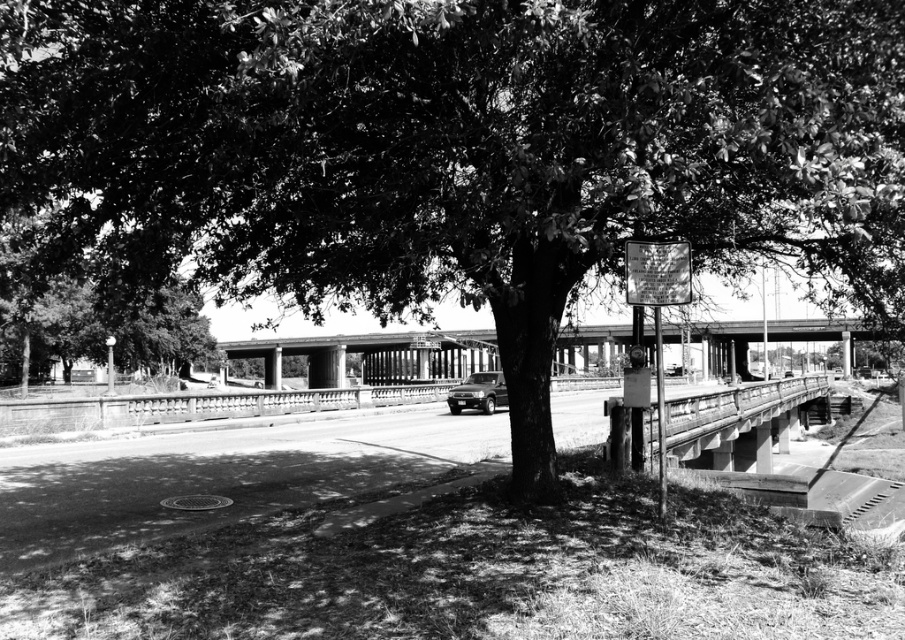
You are a pedestrian standing on the road and see the green leafy tree at left and the concrete bridge at center. Which object is closer to your left side?

The green leafy tree at left is closer to your left side because it is positioned on the left side of the concrete bridge at center.

You are standing on the road and want to take a photo of both the green leafy tree at left and the concrete bridge at center. Since you can only focus on one object at a time, which object should you focus on first to ensure the other is still in acceptable focus?

You should focus on the green leafy tree at left first because it is closer to the viewer than the concrete bridge at center. By focusing on the closer object, the farther object will still be within the depth of field, ensuring both are acceptably sharp.

You are a pedestrian standing on the road and see the green leafy tree at left and the concrete bridge at center. Which object is closer to you?

The green leafy tree at left is closer to you because it is positioned over the concrete bridge at center, indicating it is in front of the bridge.